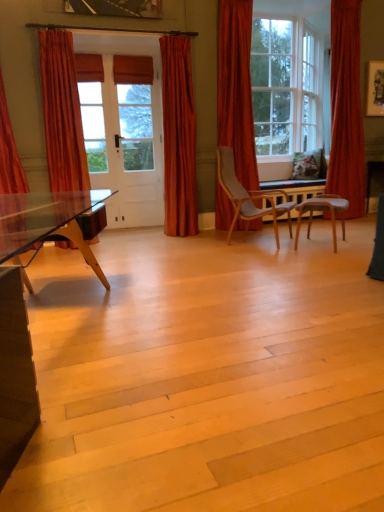
Question: Should I look upward or downward to see velvet orange curtain at right, which is counted as the fifth curtain, starting from the left?

Choices:
 (A) down
 (B) up

Answer: (B)

Question: Considering the relative positions of light gray fabric chair at center right, which is the 2th chair from left to right, and velvet orange curtain at right, which is counted as the fifth curtain, starting from the left, in the image provided, is light gray fabric chair at center right, which is the 2th chair from left to right, to the right of velvet orange curtain at right, which is counted as the fifth curtain, starting from the left, from the viewer's perspective?

Choices:
 (A) yes
 (B) no

Answer: (B)

Question: Can we say light gray fabric chair at center right, which is the 2th chair from left to right, lies outside velvet orange curtain at right, which is counted as the fifth curtain, starting from the left?

Choices:
 (A) no
 (B) yes

Answer: (B)

Question: Considering the relative sizes of light gray fabric chair at center right, which is the 2th chair from left to right, and velvet orange curtain at right, the first curtain from the right, in the image provided, is light gray fabric chair at center right, which is the 2th chair from left to right, smaller than velvet orange curtain at right, the first curtain from the right,?

Choices:
 (A) yes
 (B) no

Answer: (A)

Question: Considering the relative positions of light gray fabric chair at center right, which is the 1th chair in right-to-left order, and velvet orange curtain at right, the first curtain from the right, in the image provided, is light gray fabric chair at center right, which is the 1th chair in right-to-left order, to the left of velvet orange curtain at right, the first curtain from the right, from the viewer's perspective?

Choices:
 (A) no
 (B) yes

Answer: (B)

Question: Is light gray fabric chair at center right, which is the 2th chair from left to right, wider than velvet orange curtain at right, the first curtain from the right?

Choices:
 (A) yes
 (B) no

Answer: (A)

Question: From a real-world perspective, is light gray fabric chair at center right, which is the 1th chair in right-to-left order, positioned under velvet orange curtain at right, the first curtain from the right, based on gravity?

Choices:
 (A) yes
 (B) no

Answer: (A)

Question: Is velvet orange curtain at right, which is counted as the fifth curtain, starting from the left, positioned with its back to clear glass window at upper right?

Choices:
 (A) yes
 (B) no

Answer: (B)

Question: Can you confirm if velvet orange curtain at right, the first curtain from the right, is wider than clear glass window at upper right?

Choices:
 (A) yes
 (B) no

Answer: (B)

Question: From the image's perspective, is velvet orange curtain at right, which is counted as the fifth curtain, starting from the left, located beneath clear glass window at upper right?

Choices:
 (A) yes
 (B) no

Answer: (A)

Question: Considering the relative sizes of velvet orange curtain at right, the first curtain from the right, and clear glass window at upper right in the image provided, is velvet orange curtain at right, the first curtain from the right, smaller than clear glass window at upper right?

Choices:
 (A) no
 (B) yes

Answer: (B)

Question: Would you say velvet orange curtain at right, which is counted as the fifth curtain, starting from the left, contains clear glass window at upper right?

Choices:
 (A) no
 (B) yes

Answer: (A)

Question: Considering the relative positions of velvet orange curtain at right, the first curtain from the right, and clear glass window at upper right in the image provided, is velvet orange curtain at right, the first curtain from the right, to the left of clear glass window at upper right from the viewer's perspective?

Choices:
 (A) no
 (B) yes

Answer: (A)

Question: Considering the relative positions of matte orange curtain at center, placed as the 3th curtain when sorted from left to right, and velvet orange curtain at left, the fourth curtain viewed from the right, in the image provided, is matte orange curtain at center, placed as the 3th curtain when sorted from left to right, to the left of velvet orange curtain at left, the fourth curtain viewed from the right, from the viewer's perspective?

Choices:
 (A) no
 (B) yes

Answer: (A)